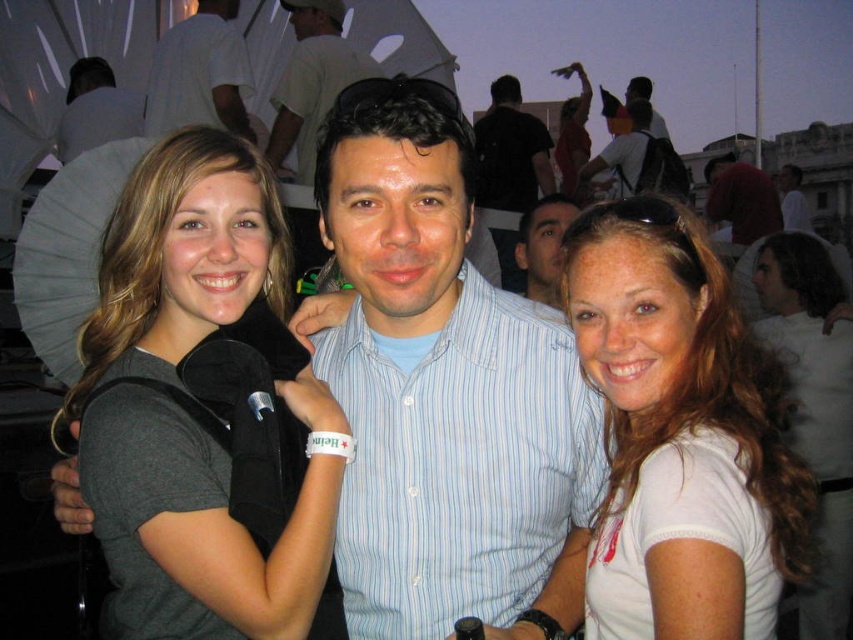
Identify the location of dark blue shirt at center. The width and height of the screenshot is (853, 640). (509, 152).

Can you confirm if dark blue shirt at center is thinner than matte black shirt at upper center?

Yes.

Is point (480, 176) more distant than point (642, 83)?

No, (480, 176) is closer to viewer.

You are a GUI agent. You are given a task and a screenshot of the screen. Output one action in this format:
    pyautogui.click(x=<x>, y=<y>)
    Task: Click on the dark blue shirt at center
    The height and width of the screenshot is (640, 853).
    Given the screenshot: What is the action you would take?
    pyautogui.click(x=509, y=152)

Is point (325, 408) in front of point (695, 268)?

No.

Can you confirm if gray matte shirt at center is positioned to the right of white matte shirt at center?

Incorrect, gray matte shirt at center is not on the right side of white matte shirt at center.

The height and width of the screenshot is (640, 853). What are the coordinates of `gray matte shirt at center` in the screenshot? It's located at point(196,529).

Locate an element on the screen. This screenshot has width=853, height=640. gray matte shirt at center is located at coordinates (196, 529).

Is dark red shirt at center closer to the viewer compared to light blue striped shirt at center?

No, it is behind light blue striped shirt at center.

Is dark red shirt at center to the left of light blue striped shirt at center from the viewer's perspective?

No, dark red shirt at center is not to the left of light blue striped shirt at center.

Image resolution: width=853 pixels, height=640 pixels. What do you see at coordinates (741, 198) in the screenshot?
I see `dark red shirt at center` at bounding box center [741, 198].

At what (x,y) coordinates should I click in order to perform the action: click on dark red shirt at center. Please return your answer as a coordinate pair (x, y). The width and height of the screenshot is (853, 640). Looking at the image, I should click on (741, 198).